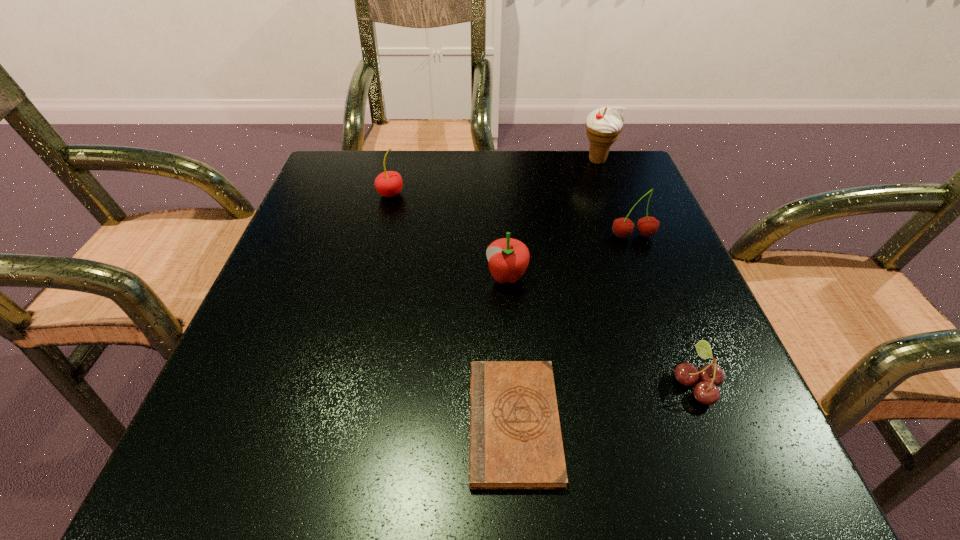
What are the coordinates of `vacant point that satisfies the following two spatial constraints: 1. on the surface of the third farthest object; 2. on the spine side of the diary` in the screenshot? It's located at (704, 423).